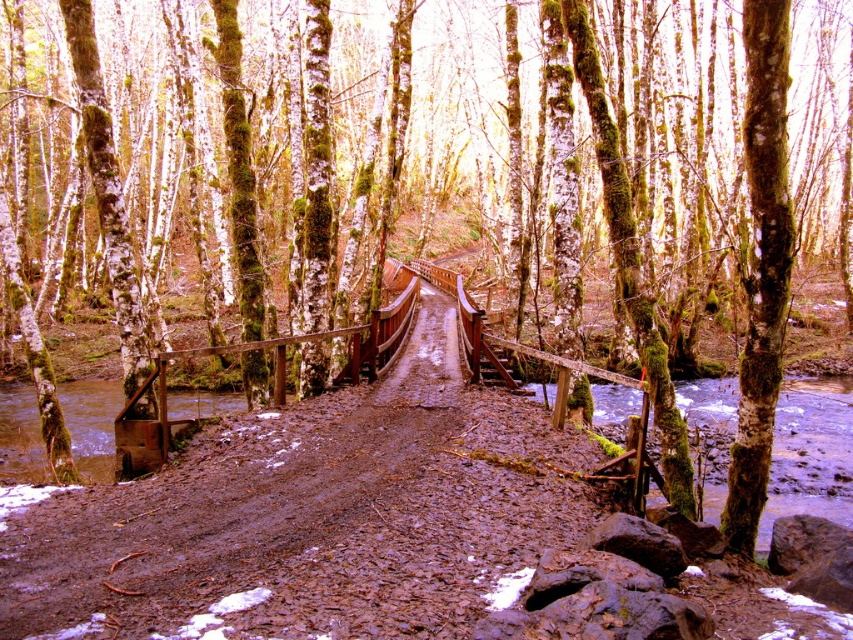
Is brown textured dirt track at center taller than clear water at lower right?

Indeed, brown textured dirt track at center has a greater height compared to clear water at lower right.

Which is below, brown textured dirt track at center or clear water at lower right?

clear water at lower right is lower down.

Is point (167, 612) farther from viewer compared to point (775, 424)?

No.

Find the location of a particular element. Image resolution: width=853 pixels, height=640 pixels. brown textured dirt track at center is located at coordinates (312, 515).